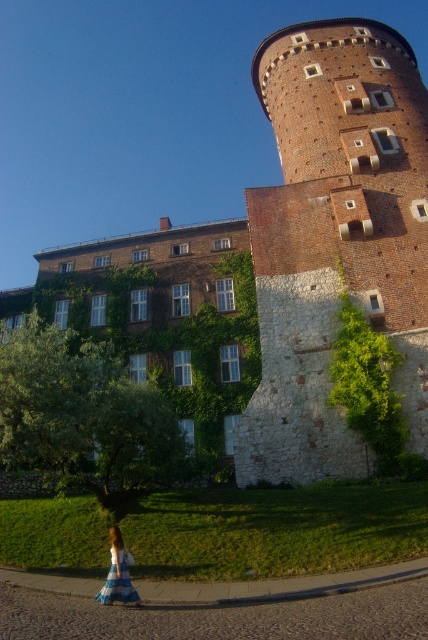
Who is higher up, brown brick tower at center or blue plaid dress at lower left?

Positioned higher is brown brick tower at center.

Between brown brick tower at center and blue plaid dress at lower left, which one appears on the right side from the viewer's perspective?

From the viewer's perspective, brown brick tower at center appears more on the right side.

The image size is (428, 640). Identify the location of brown brick tower at center. (335, 237).

Between brick tower at center and blue plaid dress at lower left, which one has less height?

With less height is blue plaid dress at lower left.

Consider the image. Who is more forward, (300, 195) or (122, 600)?

Point (122, 600) is more forward.

Identify the location of brick tower at center. (317, 241).

Where is `brick tower at center`? brick tower at center is located at coordinates (317, 241).

Can you confirm if brick tower at center is positioned above brown brick tower at center?

Answer: No, brick tower at center is not above brown brick tower at center.

Does brick tower at center appear on the right side of brown brick tower at center?

Incorrect, brick tower at center is not on the right side of brown brick tower at center.

Who is more distant from viewer, [318,52] or [397,266]?

Point [318,52]

The height and width of the screenshot is (640, 428). In order to click on brick tower at center in this screenshot , I will do `click(317, 241)`.